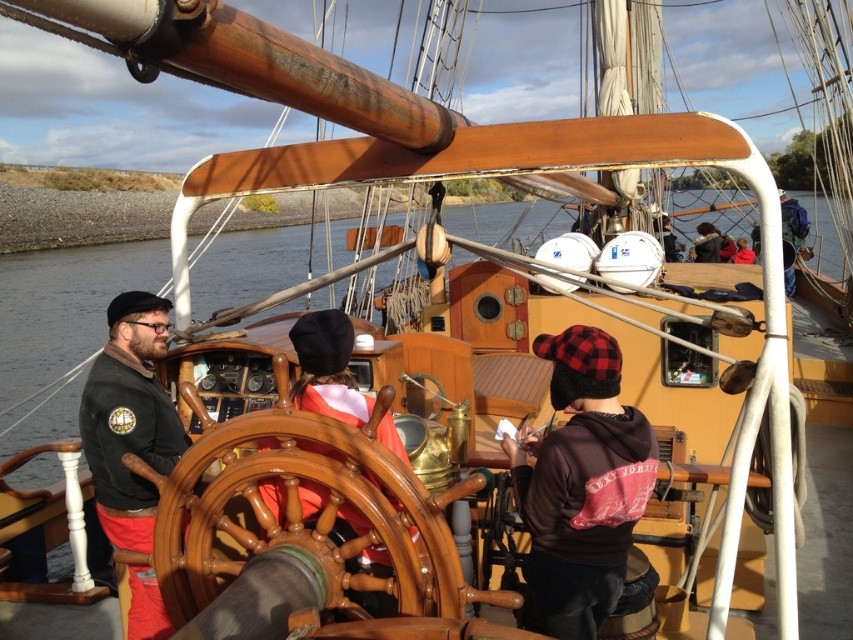
Question: Which point is closer to the camera taking this photo?

Choices:
 (A) (83, 417)
 (B) (239, 627)
 (C) (387, 493)

Answer: (B)

Question: Can you confirm if shiny brown wooden wheel at center is wider than brown leather hat at center?

Choices:
 (A) no
 (B) yes

Answer: (B)

Question: Which is farther from the shiny brown wooden wheel at center?

Choices:
 (A) wooden helm at center
 (B) brown leather hat at center

Answer: (B)

Question: Considering the relative positions of shiny brown wooden wheel at center and black matte jacket at left in the image provided, where is shiny brown wooden wheel at center located with respect to black matte jacket at left?

Choices:
 (A) left
 (B) right

Answer: (B)

Question: Which of the following is the farthest from the observer?

Choices:
 (A) (334, 340)
 (B) (131, 572)
 (C) (613, 547)
 (D) (410, 634)

Answer: (B)

Question: Considering the relative positions of brown leather hat at center and wooden helm at center in the image provided, where is brown leather hat at center located with respect to wooden helm at center?

Choices:
 (A) above
 (B) below

Answer: (B)